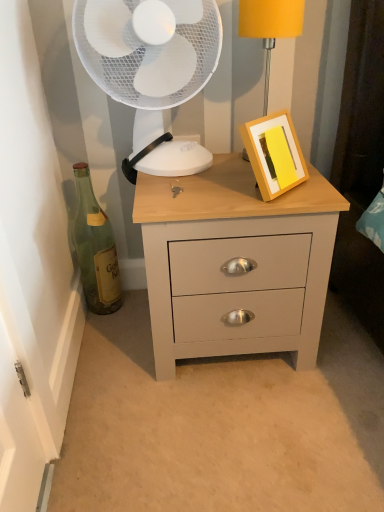
Where is `vacant area located to the right-hand side of green glass bottle at left`? Image resolution: width=384 pixels, height=512 pixels. vacant area located to the right-hand side of green glass bottle at left is located at coordinates (132, 314).